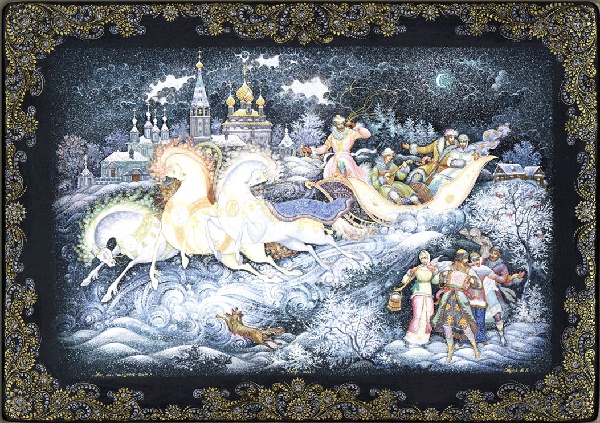
Where is `black border between main image and ornate frame`? This screenshot has width=600, height=423. black border between main image and ornate frame is located at coordinates (172, 34).